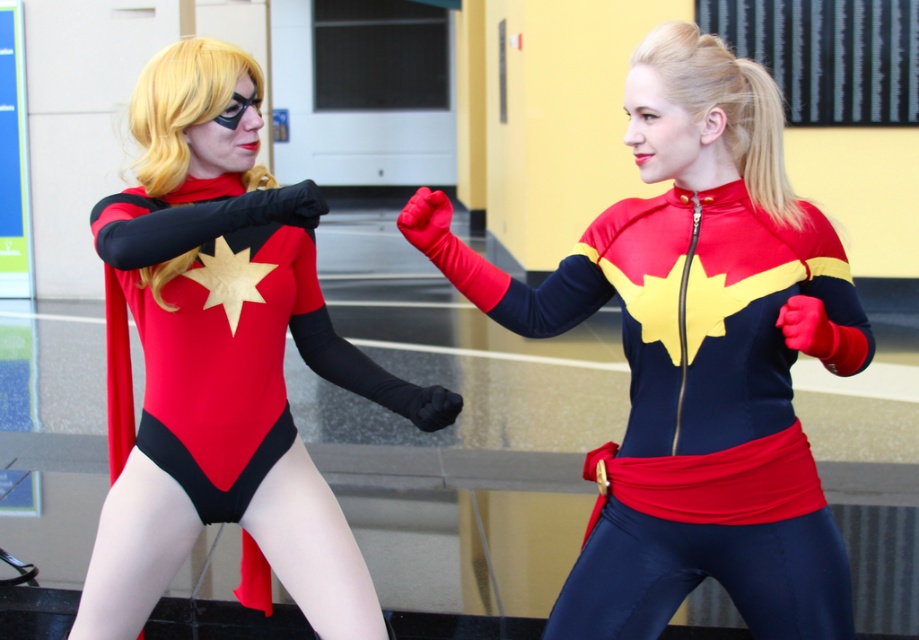
You are a costume designer preparing for a superhero movie. You need to determine which costume requires more fabric based on their size. Given that you have the shiny spandex suit at center and the matte black bodysuit at left in front of you, which one would need more fabric?

The shiny spandex suit at center requires more fabric because it has a larger size compared to the matte black bodysuit at left.

In the scene shown: You are a photographer setting up for a superhero photoshoot. You need to ensure the shiny spandex suit at center and the matte black bodysuit at left are properly positioned. Based on their current placement, which superhero costume is closer to the camera?

The shiny spandex suit at center is closer to the camera because it is positioned in front of the matte black bodysuit at left.